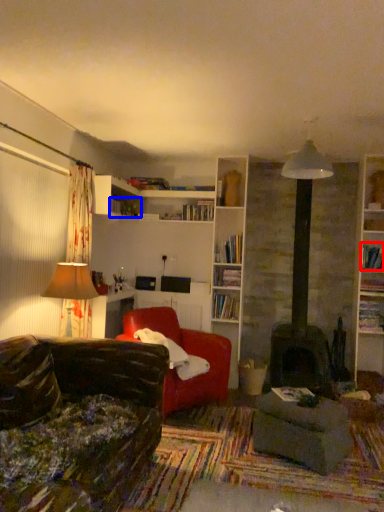
Question: Which point is further to the camera, book (highlighted by a red box) or book (highlighted by a blue box)?

Choices:
 (A) book
 (B) book

Answer: (B)